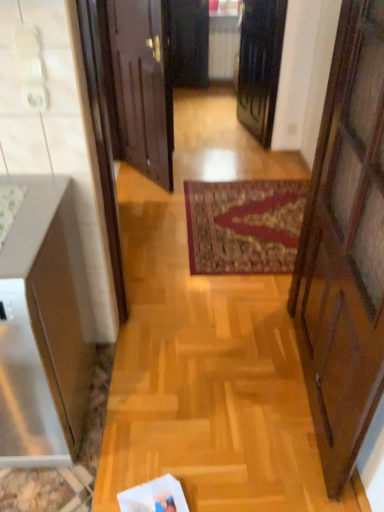
Find the location of a particular element. black glossy door at center, the first door from the right is located at coordinates (260, 65).

The height and width of the screenshot is (512, 384). I want to click on cabinetry that appears in front of the black glossy door at center, the first door from the right, so click(x=45, y=325).

In terms of width, does black glossy door at center, the first door from the right, look wider or thinner when compared to matte white cabinet at left?

Clearly, black glossy door at center, the first door from the right, has less width compared to matte white cabinet at left.

Is the surface of black glossy door at center, which ranks as the second door in left-to-right order, in direct contact with matte white cabinet at left?

No, black glossy door at center, which ranks as the second door in left-to-right order, is not in contact with matte white cabinet at left.

Is matte white cabinet at left looking in the opposite direction of black glossy door at center, the first door from the right?

No, matte white cabinet at left is not facing the opposite direction of black glossy door at center, the first door from the right.

Is matte white cabinet at left touching black glossy door at center, the first door from the right?

matte white cabinet at left and black glossy door at center, the first door from the right, are clearly separated.

The width and height of the screenshot is (384, 512). Find the location of `cabinetry in front of the black glossy door at center, the first door from the right`. cabinetry in front of the black glossy door at center, the first door from the right is located at coordinates (45, 325).

Does matte white cabinet at left turn towards wooden door at center, acting as the 2th door starting from the right?

No, matte white cabinet at left does not turn towards wooden door at center, acting as the 2th door starting from the right.

Are matte white cabinet at left and wooden door at center, the 1th door when ordered from left to right, making contact?

Result: matte white cabinet at left and wooden door at center, the 1th door when ordered from left to right, are clearly separated.

From a real-world perspective, which is physically above, matte white cabinet at left or wooden door at center, the 1th door when ordered from left to right?

In real-world perspective, wooden door at center, the 1th door when ordered from left to right, is above.

Considering the relative sizes of matte white cabinet at left and wooden door at center, the 1th door when ordered from left to right, in the image provided, is matte white cabinet at left smaller than wooden door at center, the 1th door when ordered from left to right,?

Actually, matte white cabinet at left might be larger than wooden door at center, the 1th door when ordered from left to right.

Is wooden door at center, acting as the 2th door starting from the right, thinner than matte white cabinet at left?

Yes.

Is wooden door at center, the 1th door when ordered from left to right, positioned far away from matte white cabinet at left?

Absolutely, wooden door at center, the 1th door when ordered from left to right, is distant from matte white cabinet at left.

Can you confirm if wooden door at center, acting as the 2th door starting from the right, is bigger than matte white cabinet at left?

Incorrect, wooden door at center, acting as the 2th door starting from the right, is not larger than matte white cabinet at left.

From the image's perspective, starting from the matte white cabinet at left, which door is the 1st one above? Please provide its 2D coordinates.

[(143, 85)]

Is point (252, 33) farther from viewer compared to point (170, 120)?

Yes, it is behind point (170, 120).

Are black glossy door at center, which ranks as the second door in left-to-right order, and wooden door at center, the 1th door when ordered from left to right, located far from each other?

Yes, black glossy door at center, which ranks as the second door in left-to-right order, and wooden door at center, the 1th door when ordered from left to right, are quite far apart.

Looking at their sizes, would you say black glossy door at center, the first door from the right, is wider or thinner than wooden door at center, acting as the 2th door starting from the right?

black glossy door at center, the first door from the right, is wider than wooden door at center, acting as the 2th door starting from the right.

Which is more to the right, black glossy door at center, the first door from the right, or wooden door at center, acting as the 2th door starting from the right?

Positioned to the right is black glossy door at center, the first door from the right.

From a real-world perspective, is wooden door at center, acting as the 2th door starting from the right, positioned over black glossy door at center, which ranks as the second door in left-to-right order, based on gravity?

Yes, from a real-world perspective, wooden door at center, acting as the 2th door starting from the right, is on top of black glossy door at center, which ranks as the second door in left-to-right order.

From the image's perspective, who appears lower, wooden door at center, acting as the 2th door starting from the right, or black glossy door at center, which ranks as the second door in left-to-right order?

wooden door at center, acting as the 2th door starting from the right, is shown below in the image.

Considering the sizes of wooden door at center, acting as the 2th door starting from the right, and black glossy door at center, the first door from the right, in the image, is wooden door at center, acting as the 2th door starting from the right, taller or shorter than black glossy door at center, the first door from the right,?

Considering their sizes, wooden door at center, acting as the 2th door starting from the right, has more height than black glossy door at center, the first door from the right.

Which of these two, wooden door at center, the 1th door when ordered from left to right, or black glossy door at center, which ranks as the second door in left-to-right order, is wider?

black glossy door at center, which ranks as the second door in left-to-right order, is wider.

Where is `cabinetry below the black glossy door at center, which ranks as the second door in left-to-right order (from the image's perspective)`? cabinetry below the black glossy door at center, which ranks as the second door in left-to-right order (from the image's perspective) is located at coordinates (45, 325).

From the image's perspective, which door is the 2nd one above the matte white cabinet at left? Please provide its 2D coordinates.

[(260, 65)]

Based on their spatial positions, is wooden door at center, the 1th door when ordered from left to right, or matte white cabinet at left further from black glossy door at center, the first door from the right?

matte white cabinet at left is further to black glossy door at center, the first door from the right.

Estimate the real-world distances between objects in this image. Which object is further from wooden door at center, the 1th door when ordered from left to right, black glossy door at center, which ranks as the second door in left-to-right order, or matte white cabinet at left?

Based on the image, matte white cabinet at left appears to be further to wooden door at center, the 1th door when ordered from left to right.

When comparing their distances from matte white cabinet at left, does wooden door at center, acting as the 2th door starting from the right, or black glossy door at center, which ranks as the second door in left-to-right order, seem further?

black glossy door at center, which ranks as the second door in left-to-right order, is further to matte white cabinet at left.

Which object lies nearer to the anchor point matte white cabinet at left, black glossy door at center, which ranks as the second door in left-to-right order, or wooden door at center, the 1th door when ordered from left to right?

Based on the image, wooden door at center, the 1th door when ordered from left to right, appears to be nearer to matte white cabinet at left.

Based on their spatial positions, is matte white cabinet at left or wooden door at center, acting as the 2th door starting from the right, closer to black glossy door at center, the first door from the right?

Based on the image, wooden door at center, acting as the 2th door starting from the right, appears to be nearer to black glossy door at center, the first door from the right.

Considering their positions, is matte white cabinet at left positioned further to wooden door at center, acting as the 2th door starting from the right, than black glossy door at center, which ranks as the second door in left-to-right order?

matte white cabinet at left lies further to wooden door at center, acting as the 2th door starting from the right, than the other object.

Identify the location of door positioned between matte white cabinet at left and black glossy door at center, the first door from the right, from near to far. This screenshot has width=384, height=512. (143, 85).